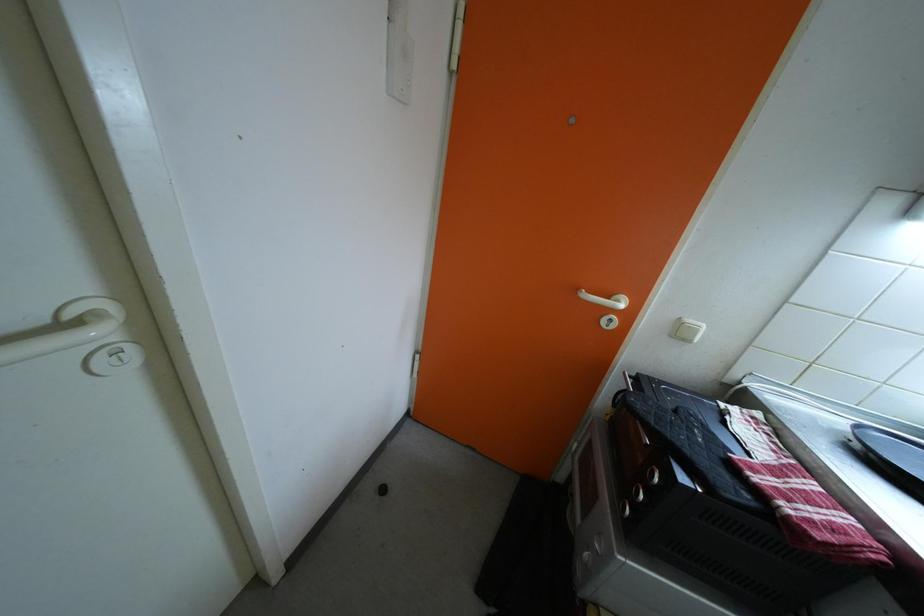
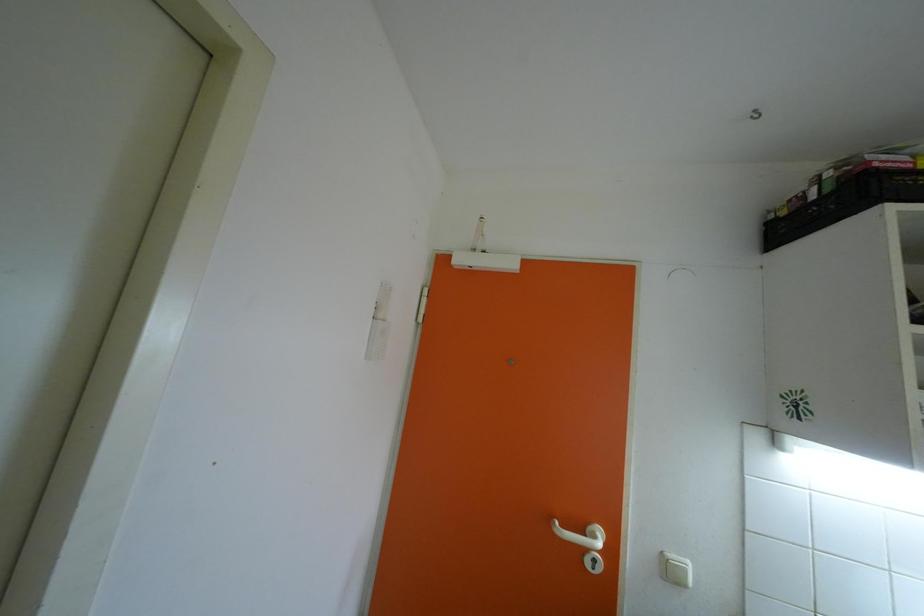
Question: How did the camera likely rotate?

Choices:
 (A) Left
 (B) Right
 (C) Up
 (D) Down

Answer: (C)